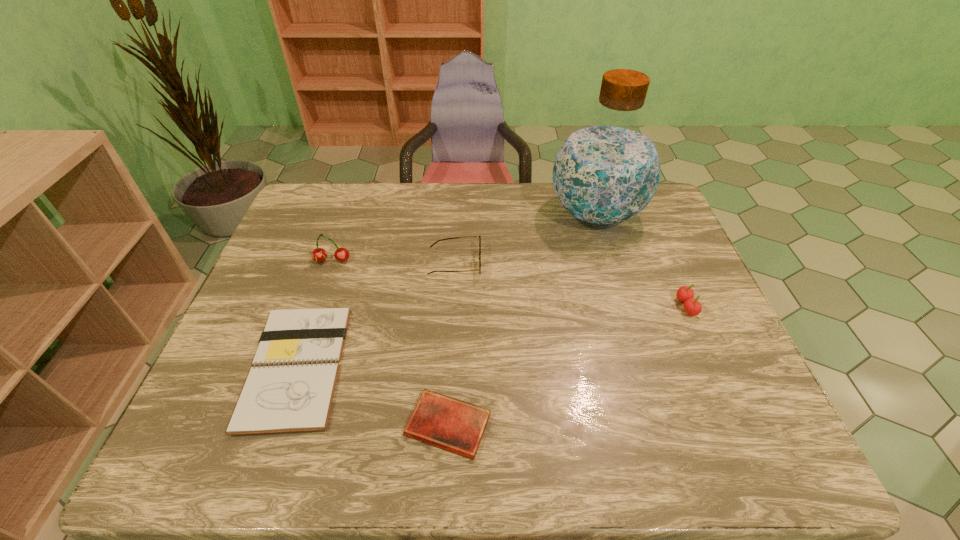
You are a GUI agent. You are given a task and a screenshot of the screen. Output one action in this format:
    pyautogui.click(x=<x>, y=<y>)
    Task: Click on the vacant region that satisfies the following two spatial constraints: 1. with stems pointing upwards on the diary; 2. on the left side of the left cherry
    The image size is (960, 540).
    Given the screenshot: What is the action you would take?
    pyautogui.click(x=276, y=425)

Find the location of `vacant region that satisfies the following two spatial constraints: 1. on the face of the spectacles; 2. on the right side of the shorter cherry`. vacant region that satisfies the following two spatial constraints: 1. on the face of the spectacles; 2. on the right side of the shorter cherry is located at coordinates (452, 307).

What are the coordinates of `free space in the image that satisfies the following two spatial constraints: 1. on the face of the fourth tallest object; 2. on the right side of the shortest object` in the screenshot? It's located at (445, 425).

Where is `vacant region that satisfies the following two spatial constraints: 1. with stems pointing upwards on the taller cherry; 2. on the right side of the diary`? The height and width of the screenshot is (540, 960). vacant region that satisfies the following two spatial constraints: 1. with stems pointing upwards on the taller cherry; 2. on the right side of the diary is located at coordinates point(276,425).